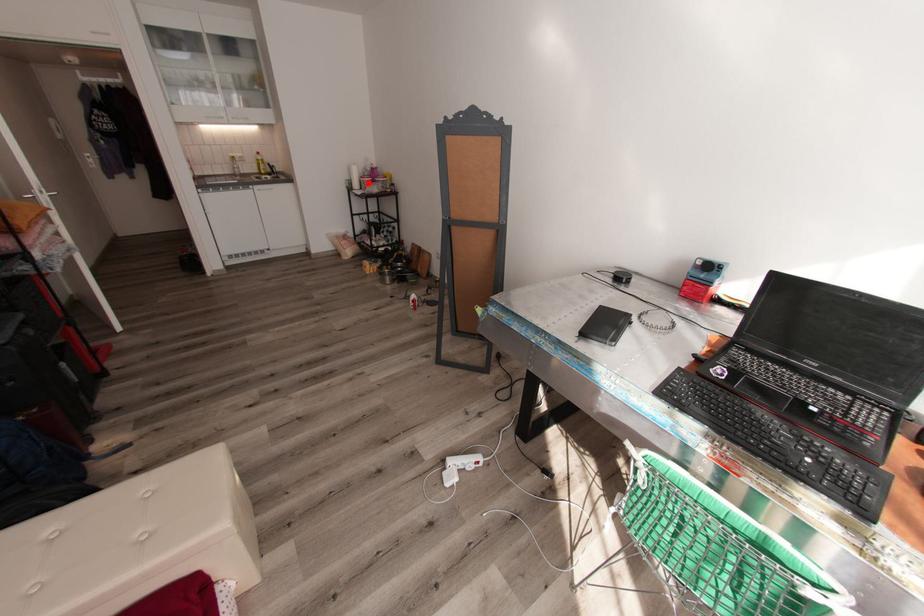
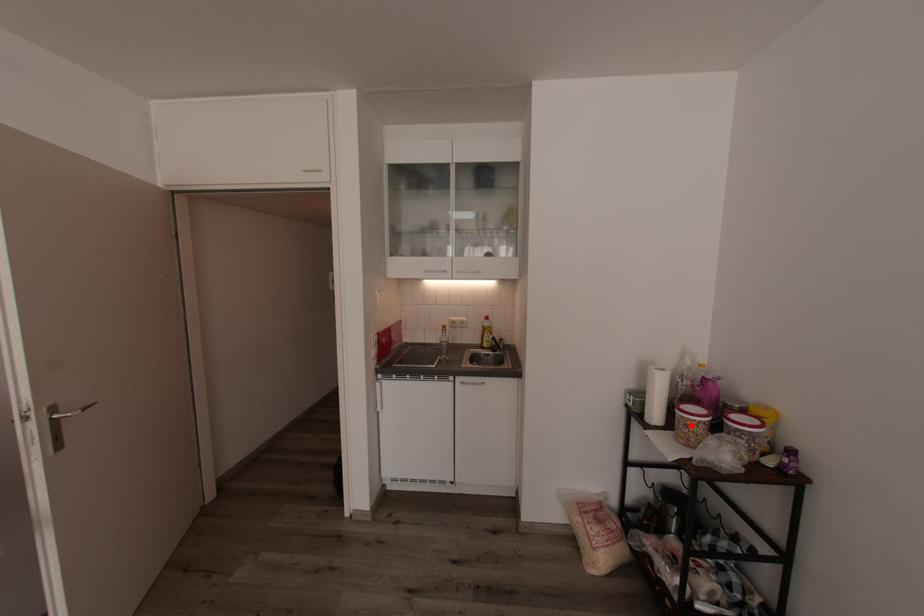
I am providing you with two images of the same scene from different viewpoints. A red point is marked on the first image and another point is marked on the second image. Is the marked point in image1 the same physical position as the marked point in image2?

Yes